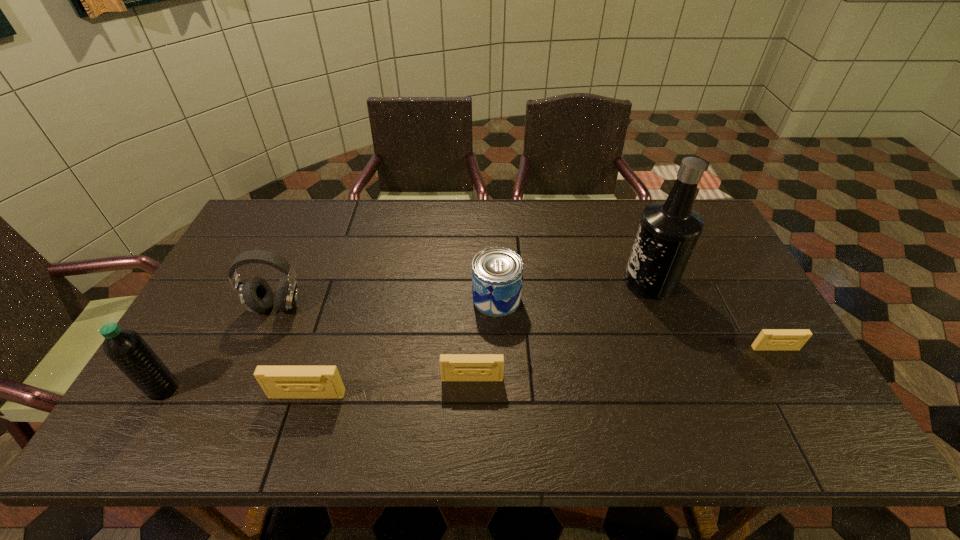
Locate which object is the fifth closest to the liquor. Please provide its 2D coordinates. Your answer should be formatted as a tuple, i.e. [(x, y)], where the tuple contains the x and y coordinates of a point satisfying the conditions above.

[(256, 295)]

Select which object is the sixth closest to the leftmost object. Please provide its 2D coordinates. Your answer should be formatted as a tuple, i.e. [(x, y)], where the tuple contains the x and y coordinates of a point satisfying the conditions above.

[(768, 339)]

Identify the location of videotape that is the third nearest to the second tallest object. The height and width of the screenshot is (540, 960). (768, 339).

Choose which videotape is the third nearest neighbor to the water bottle. Please provide its 2D coordinates. Your answer should be formatted as a tuple, i.e. [(x, y)], where the tuple contains the x and y coordinates of a point satisfying the conditions above.

[(768, 339)]

Image resolution: width=960 pixels, height=540 pixels. I want to click on free space that satisfies the following two spatial constraints: 1. on the front label of the liquor; 2. at the front of the second shortest videotape with spools, so click(x=686, y=379).

Identify the location of free space that satisfies the following two spatial constraints: 1. on the front label of the can; 2. at the front of the second farthest videotape with spools. This screenshot has width=960, height=540. (499, 379).

Find the location of a particular element. The image size is (960, 540). vacant space that satisfies the following two spatial constraints: 1. on the front label of the fourth shortest object; 2. at the front of the second videotape from right to left with spools is located at coordinates (499, 379).

This screenshot has height=540, width=960. Find the location of `free location that satisfies the following two spatial constraints: 1. on the front label of the can; 2. on the ear cups of the fifth shortest object`. free location that satisfies the following two spatial constraints: 1. on the front label of the can; 2. on the ear cups of the fifth shortest object is located at coordinates (496, 306).

Where is `free space that satisfies the following two spatial constraints: 1. on the front label of the sixth object from left to right; 2. on the ear cups of the headset`? The image size is (960, 540). free space that satisfies the following two spatial constraints: 1. on the front label of the sixth object from left to right; 2. on the ear cups of the headset is located at coordinates (659, 306).

Locate an element on the screen. The width and height of the screenshot is (960, 540). free space that satisfies the following two spatial constraints: 1. on the front label of the second object from right to left; 2. on the ear cups of the third tallest object is located at coordinates (659, 306).